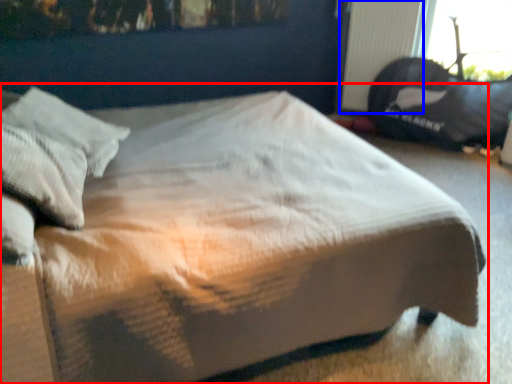
Question: Which point is further to the camera, bed (highlighted by a red box) or radiator (highlighted by a blue box)?

Choices:
 (A) bed
 (B) radiator

Answer: (B)